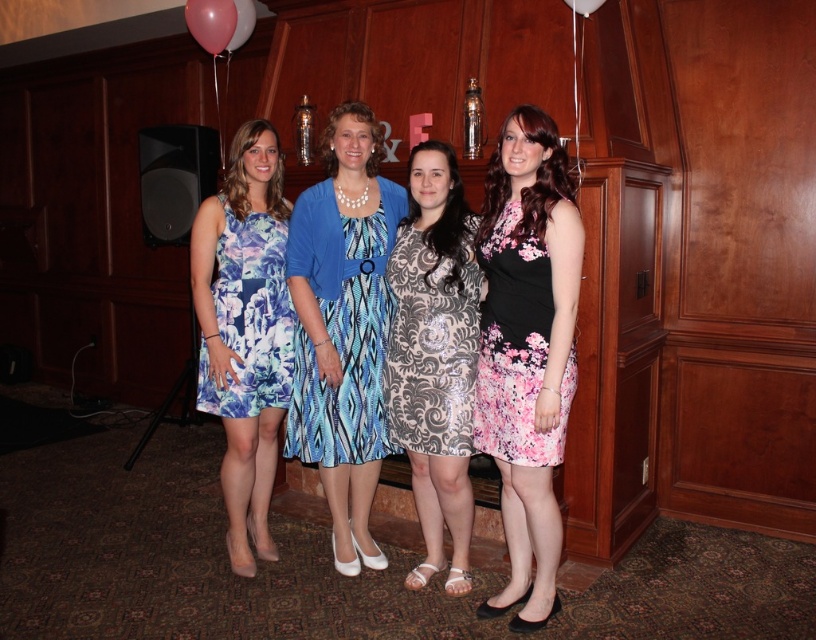
Can you confirm if floral print fabric dress at left is positioned to the left of pink glossy balloon at upper left?

In fact, floral print fabric dress at left is to the right of pink glossy balloon at upper left.

I want to click on floral print fabric dress at left, so click(247, 317).

From the picture: Is floral print dress at center behind blue zigzag dress at center?

Yes, floral print dress at center is behind blue zigzag dress at center.

Is floral print dress at center to the right of blue zigzag dress at center from the viewer's perspective?

No, floral print dress at center is not to the right of blue zigzag dress at center.

This screenshot has width=816, height=640. Identify the location of floral print dress at center. (245, 330).

Between blue zigzag dress at center and floral-patterned fabric dress at right, which one has more height?

Standing taller between the two is blue zigzag dress at center.

Is point (307, 244) positioned behind point (548, 301)?

Yes, it is behind point (548, 301).

Identify the location of blue zigzag dress at center. This screenshot has width=816, height=640. (340, 330).